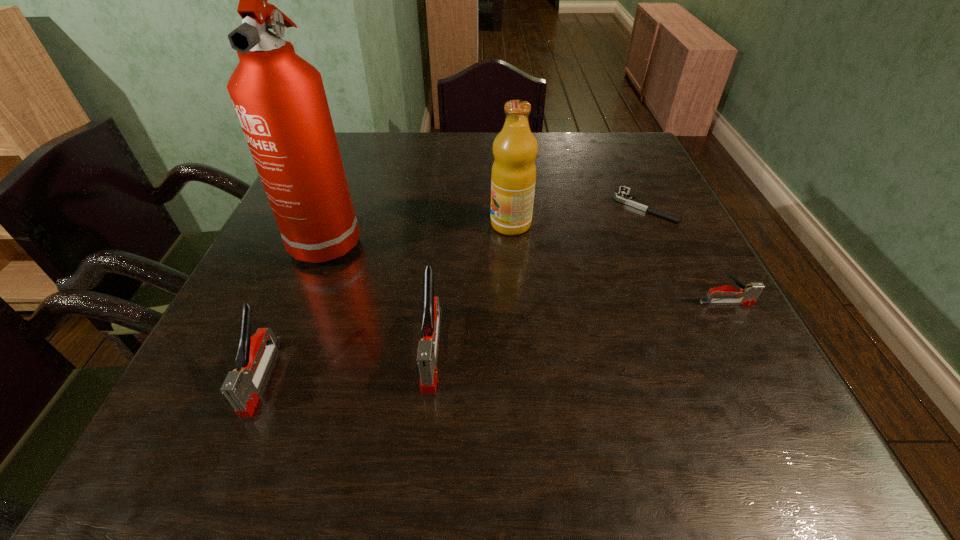
Find the location of a particular element. This screenshot has width=960, height=540. vacant area that satisfies the following two spatial constraints: 1. on the front-facing side of the shortest object; 2. on the handle side of the fourth object from right to left is located at coordinates (709, 349).

This screenshot has height=540, width=960. Find the location of `free region that satisfies the following two spatial constraints: 1. on the front-facing side of the shortest object; 2. on the handle side of the second stapler from right to left`. free region that satisfies the following two spatial constraints: 1. on the front-facing side of the shortest object; 2. on the handle side of the second stapler from right to left is located at coordinates (709, 349).

Find the location of `vacant space that satisfies the following two spatial constraints: 1. on the front-facing side of the shortest object; 2. on the handle side of the third shortest object`. vacant space that satisfies the following two spatial constraints: 1. on the front-facing side of the shortest object; 2. on the handle side of the third shortest object is located at coordinates (722, 376).

Locate an element on the screen. free space that satisfies the following two spatial constraints: 1. on the front label of the fruit juice; 2. at the nozzle of the tallest object is located at coordinates (512, 236).

Locate an element on the screen. The width and height of the screenshot is (960, 540). free space that satisfies the following two spatial constraints: 1. on the handle side of the fifth tallest object; 2. on the handle side of the fourth object from right to left is located at coordinates (752, 349).

I want to click on vacant region that satisfies the following two spatial constraints: 1. on the front-facing side of the pistol; 2. on the handle side of the second shortest stapler, so click(722, 376).

Where is `vacant area in the image that satisfies the following two spatial constraints: 1. on the front-facing side of the pistol; 2. on the handle side of the third object from left to right`? This screenshot has width=960, height=540. vacant area in the image that satisfies the following two spatial constraints: 1. on the front-facing side of the pistol; 2. on the handle side of the third object from left to right is located at coordinates (709, 349).

Where is `free space that satisfies the following two spatial constraints: 1. on the front label of the second tallest object; 2. on the handle side of the second stapler from right to left`? The height and width of the screenshot is (540, 960). free space that satisfies the following two spatial constraints: 1. on the front label of the second tallest object; 2. on the handle side of the second stapler from right to left is located at coordinates (521, 349).

Identify the location of free space that satisfies the following two spatial constraints: 1. on the handle side of the farthest stapler; 2. on the handle side of the second tallest stapler. The width and height of the screenshot is (960, 540). (766, 376).